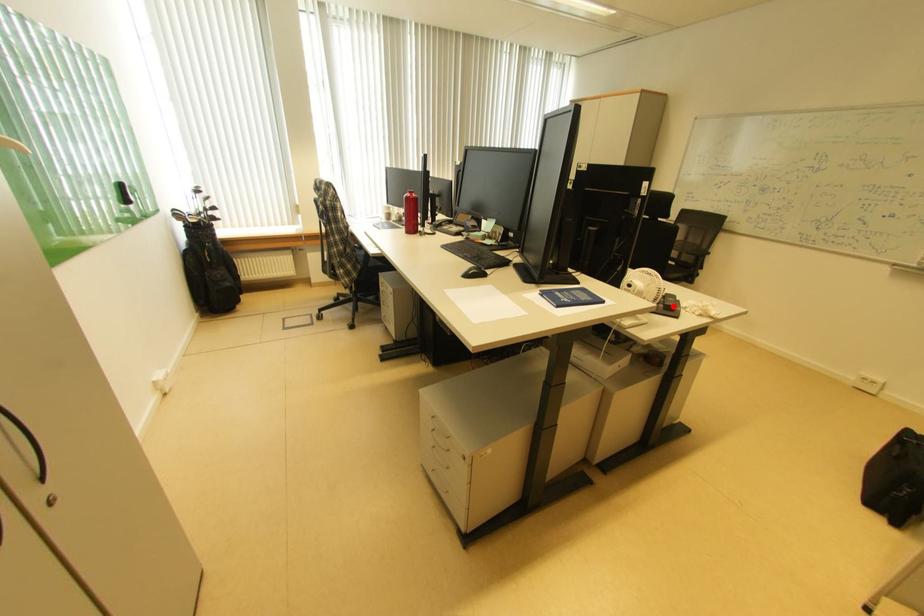
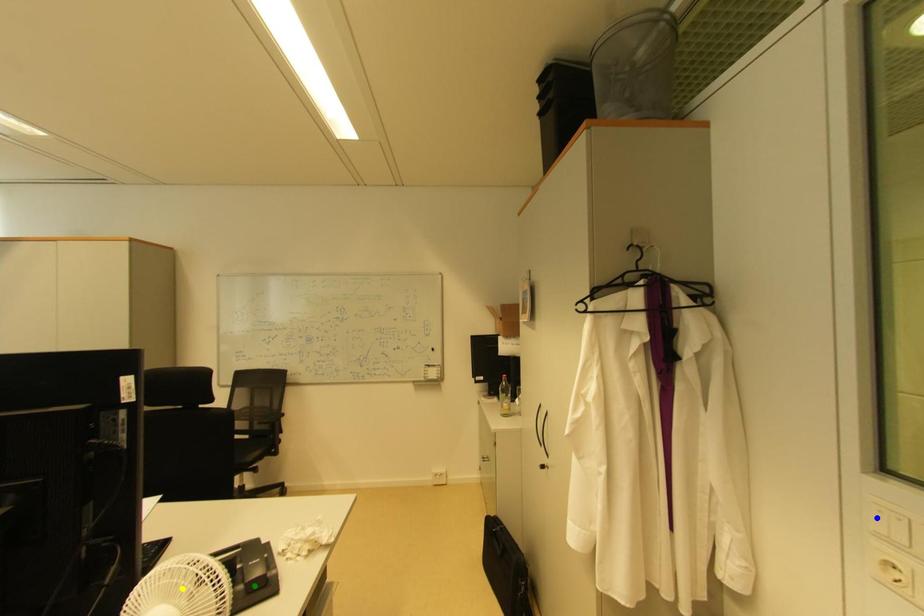
Question: I am providing you with two images of the same scene from different viewpoints. A red point is marked on the first image. You are given multiple points on the second image. Which spot in image 2 lines up with the point in image 1?

Choices:
 (A) yellow point
 (B) green point
 (C) blue point

Answer: (B)